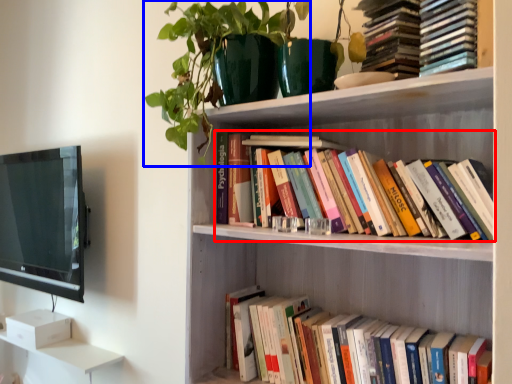
Question: Which point is further to the camera, book (highlighted by a red box) or plant (highlighted by a blue box)?

Choices:
 (A) book
 (B) plant

Answer: (B)